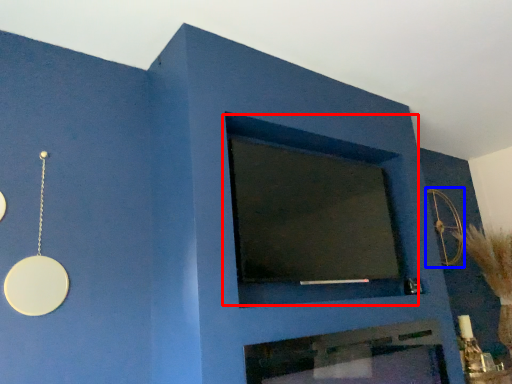
Question: Which object appears closest to the camera in this image, window (highlighted by a red box) or circle (highlighted by a blue box)?

Choices:
 (A) window
 (B) circle

Answer: (A)